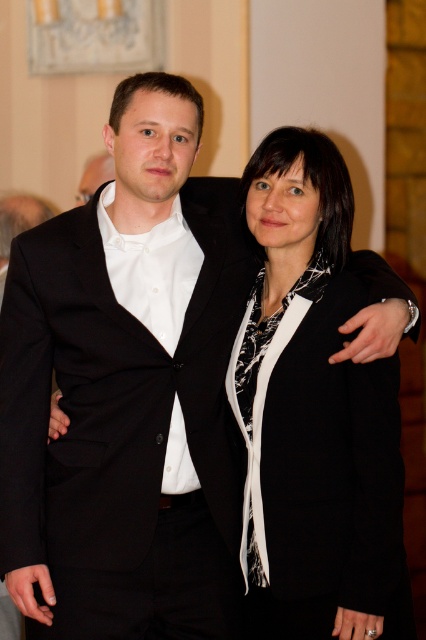
You are at a formal event and need to locate two attendees wearing specific attire. The black woolen suit at left and the black matte blazer at center are both present. Which one is positioned further to the left side of the image?

The black woolen suit at left is positioned to the left of the black matte blazer at center, so it is further to the left side of the image.

Looking at this image, you are a photographer setting up for a group photo. You need to ensure that all participants can fit within the camera frame. Given that the black woolen suit at left and the black matte blazer at center are the only two people in the frame, will the width of the camera frame need to accommodate the wider of the two?

The black woolen suit at left is wider than the black matte blazer at center, so the camera frame must accommodate the width of the black woolen suit at left to ensure both fit properly.